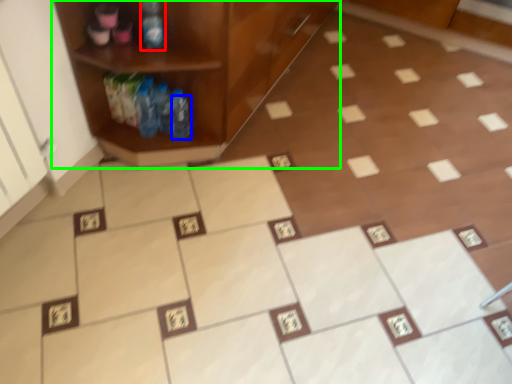
Question: Which object is the closest to the bottle (highlighted by a red box)? Choose among these: bottle (highlighted by a blue box) or shelf (highlighted by a green box).

Choices:
 (A) bottle
 (B) shelf

Answer: (B)